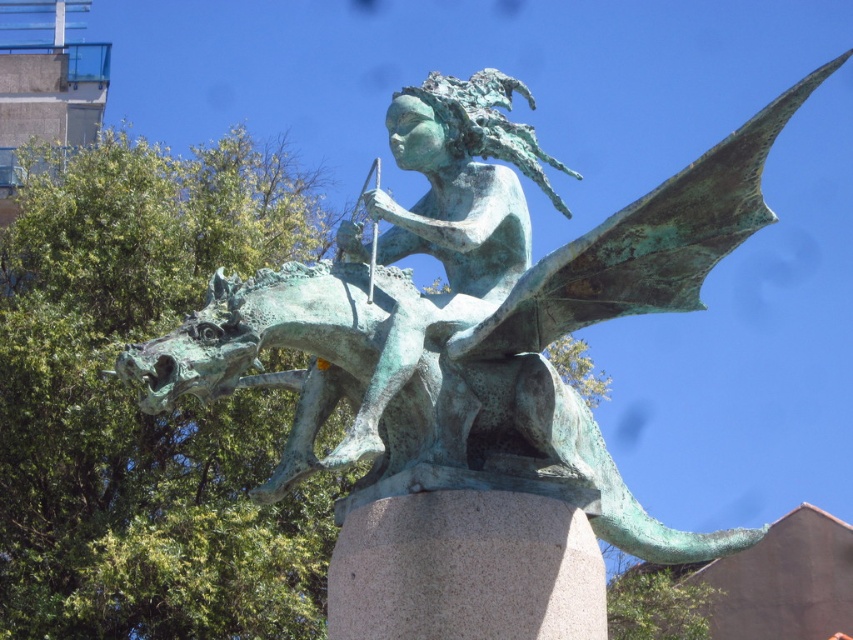
In the scene shown: Which is more to the right, green patina dragon at center or green patina statue at center?

green patina dragon at center is more to the right.

Does point (363, 486) come farther from viewer compared to point (418, 234)?

Yes.

Locate an element on the screen. Image resolution: width=853 pixels, height=640 pixels. green patina dragon at center is located at coordinates (474, 317).